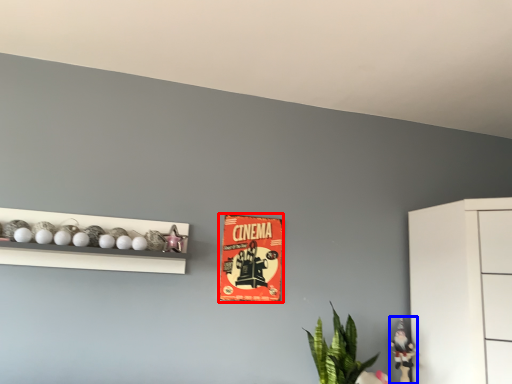
Question: Among these objects, which one is farthest to the camera, postcard (highlighted by a red box) or toy (highlighted by a blue box)?

Choices:
 (A) postcard
 (B) toy

Answer: (A)